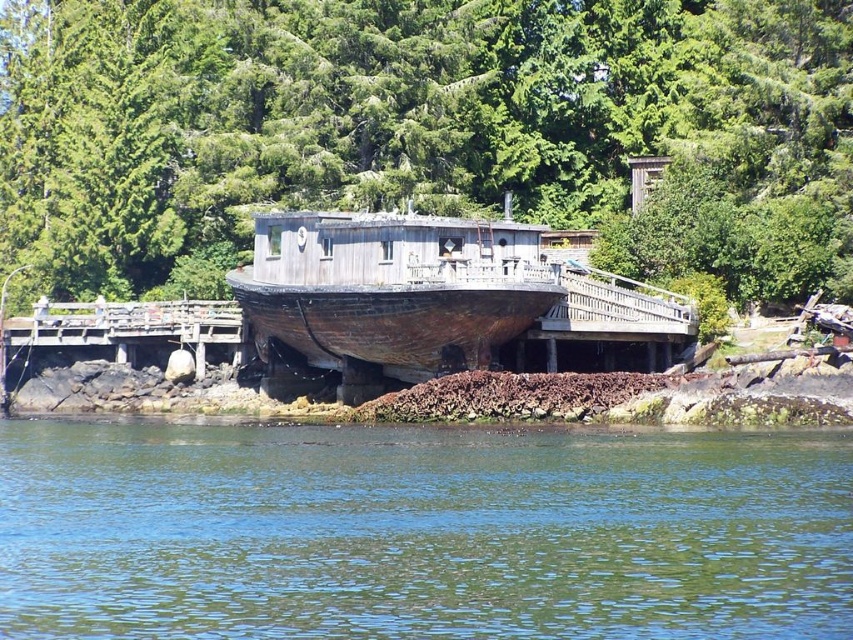
You are standing on the pier and looking towards the green textured tree at upper center and the green water at lower center. Which object is taller?

The green textured tree at upper center is taller than the green water at lower center.

You are standing on the pier and see the wooden boat undergoing maintenance. There is a point at coordinates (x=421, y=531). What is located at that point?

The point at coordinates (x=421, y=531) corresponds to green water at lower center.

You are standing on the pier and want to locate the green textured tree at upper center. According to the coordinates provided, where should you look relative to your position?

The green textured tree at upper center is located at coordinates 0.195 on the x axis and 0.489 on the y axis, so you should look towards the upper left direction from your current position on the pier.